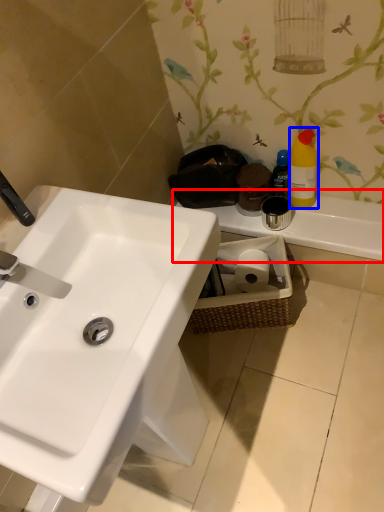
Question: Which object appears farthest to the camera in this image, counter top (highlighted by a red box) or cleaning product (highlighted by a blue box)?

Choices:
 (A) counter top
 (B) cleaning product

Answer: (A)